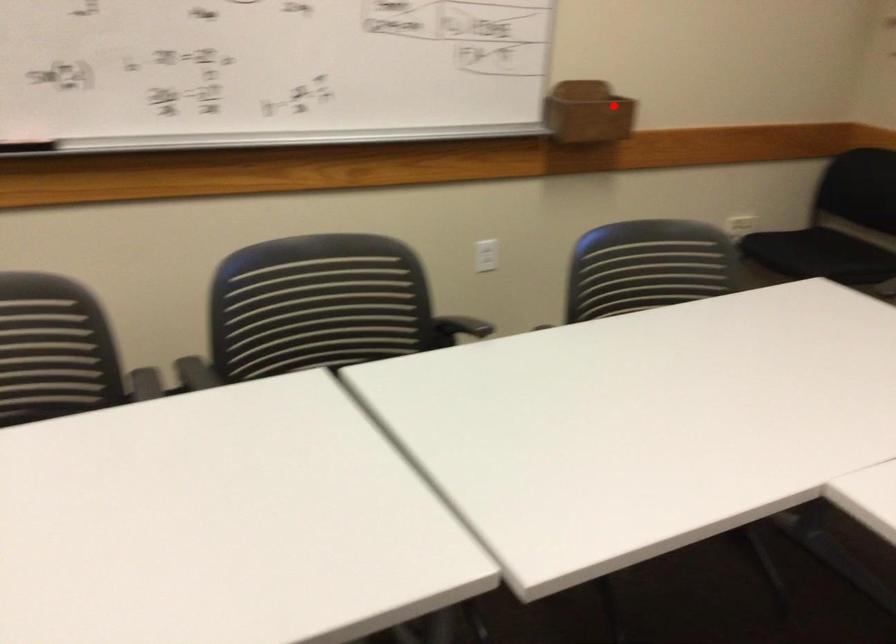
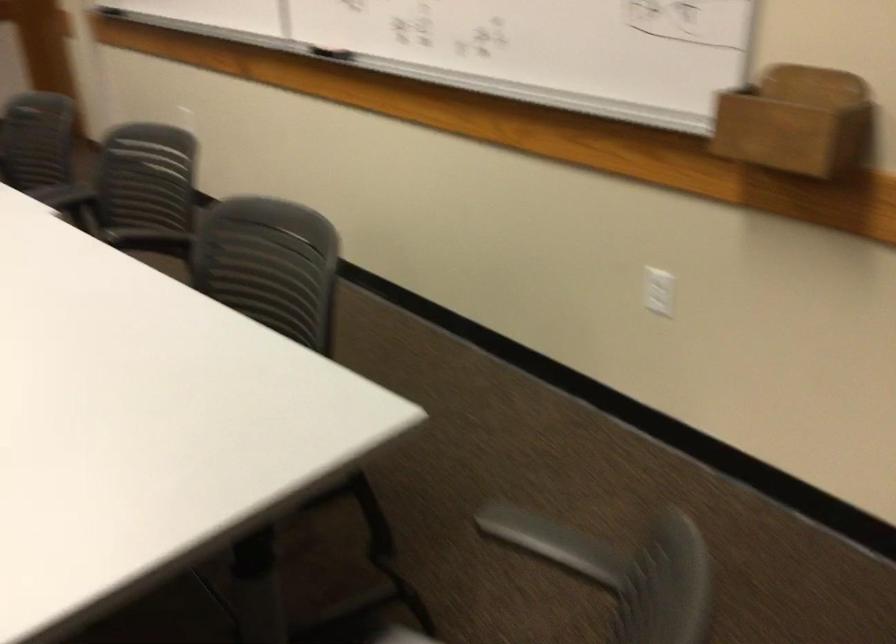
Question: I am providing you with two images of the same scene from different viewpoints. Image1 has a red point marked. In image2, the corresponding 3D location appears at what relative position? Reply with the corresponding letter.

Choices:
 (A) Closer
 (B) Farther

Answer: (A)